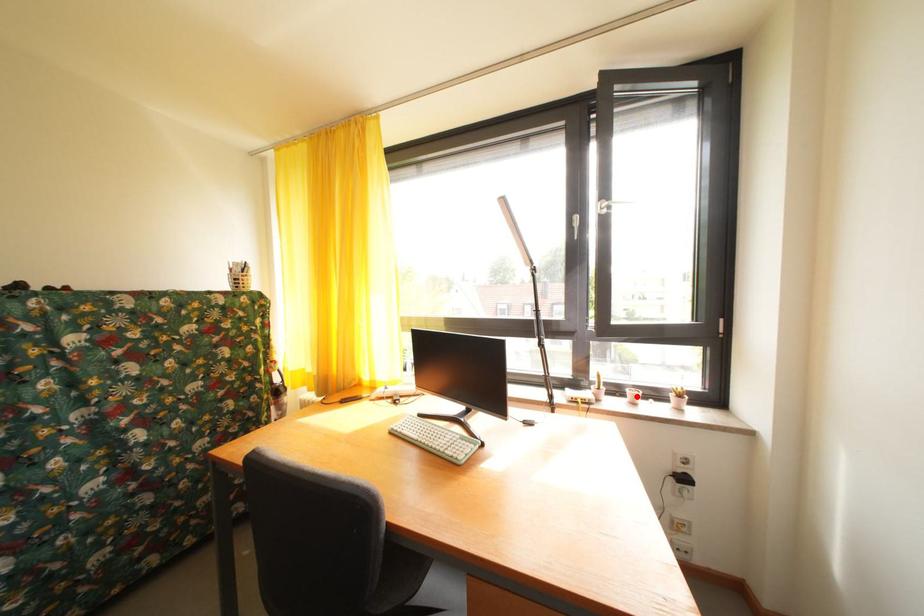
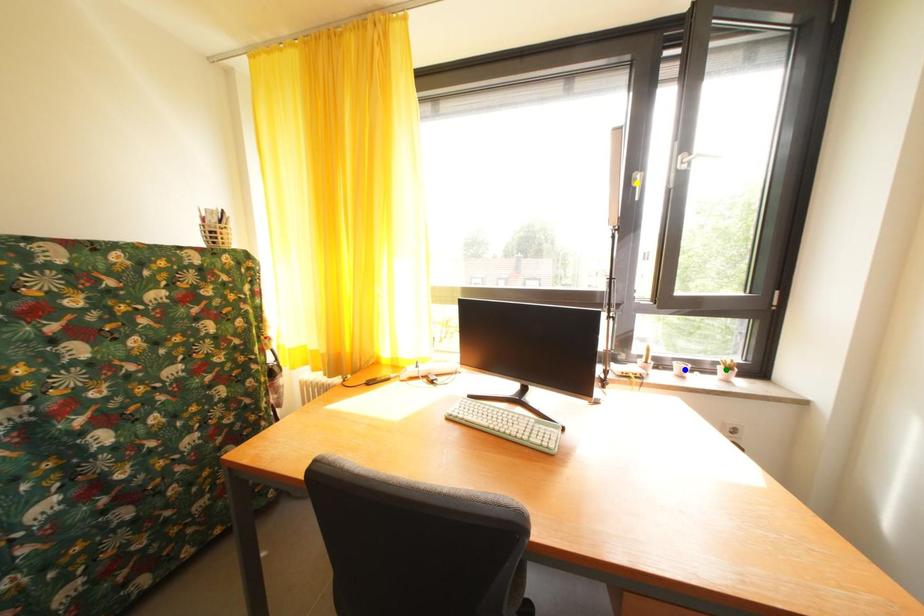
Question: I am providing you with two images of the same scene from different viewpoints. A red point is marked on the first image. You are given multiple points on the second image. In image 2, which mark is for the same physical point as the one in image 1?

Choices:
 (A) blue point
 (B) yellow point
 (C) green point

Answer: (A)